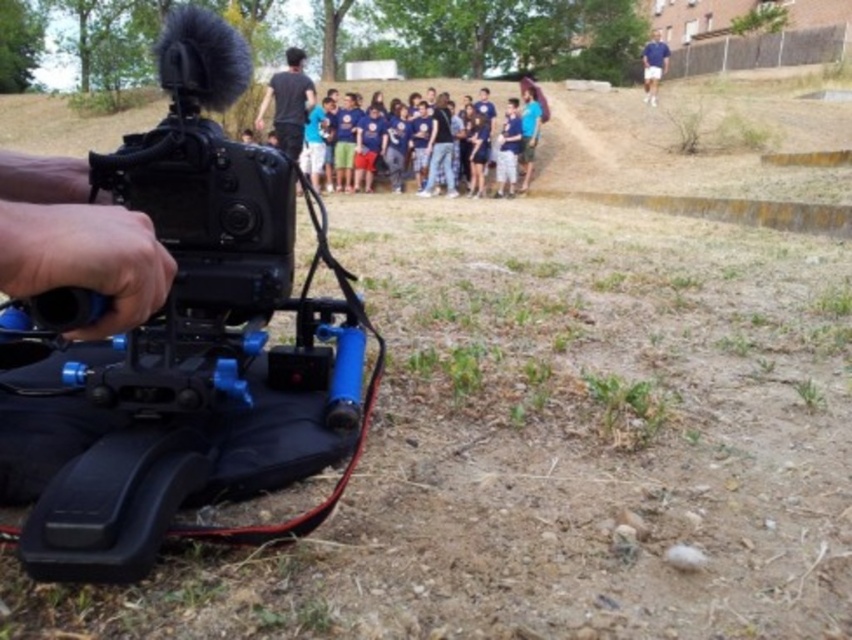
Between blue cotton shirt at center and blue cotton shirt at upper right, which one has less height?

blue cotton shirt at center is shorter.

Does blue cotton shirt at center have a lesser height compared to blue cotton shirt at upper right?

Correct, blue cotton shirt at center is not as tall as blue cotton shirt at upper right.

Which is in front, point (465, 173) or point (654, 77)?

Point (465, 173) is more forward.

You are a GUI agent. You are given a task and a screenshot of the screen. Output one action in this format:
    pyautogui.click(x=<x>, y=<y>)
    Task: Click on the blue cotton shirt at center
    
    Given the screenshot: What is the action you would take?
    pyautogui.click(x=528, y=125)

Measure the distance between black plastic video camera at left and camera.

14.92 inches

Does black plastic video camera at left appear over blue cotton shirt at upper right?

No.

Find the location of a particular element. The height and width of the screenshot is (640, 852). black plastic video camera at left is located at coordinates (183, 346).

Find the location of a particular element. black plastic video camera at left is located at coordinates (183, 346).

Who is positioned more to the left, black plastic video camera at left or blue cotton shirt at center?

Positioned to the left is black plastic video camera at left.

Between black plastic video camera at left and blue cotton shirt at center, which one has less height?

black plastic video camera at left

Which is in front, point (210, 481) or point (534, 100)?

Point (210, 481) is in front.

The height and width of the screenshot is (640, 852). I want to click on black plastic video camera at left, so click(x=183, y=346).